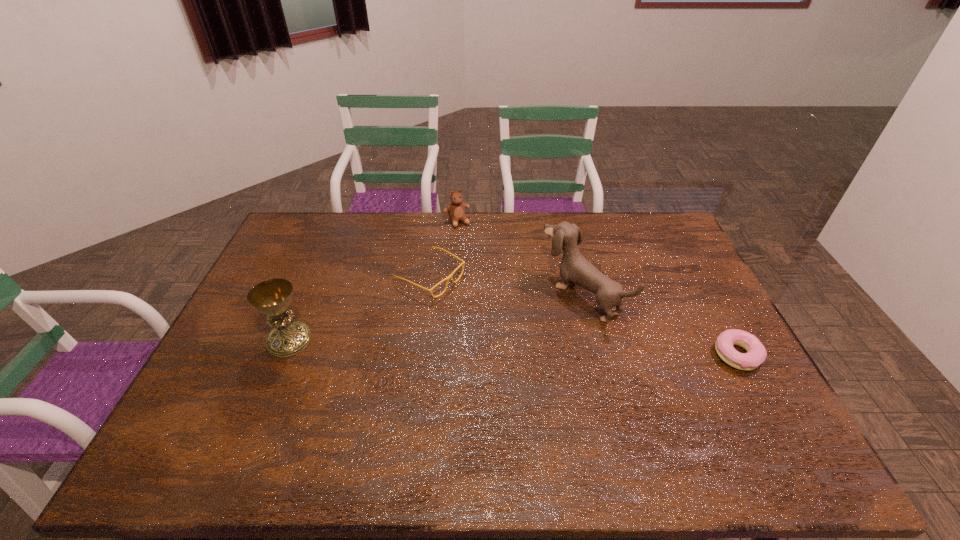
The height and width of the screenshot is (540, 960). What are the coordinates of `the leftmost object` in the screenshot? It's located at (272, 297).

Where is `doughnut`? This screenshot has width=960, height=540. doughnut is located at coordinates (756, 354).

At what (x,y) coordinates should I click in order to perform the action: click on spectacles. Please return your answer as a coordinate pair (x, y). This screenshot has width=960, height=540. Looking at the image, I should click on (463, 262).

The height and width of the screenshot is (540, 960). In order to click on puppy in this screenshot , I will do `click(574, 267)`.

Where is `the third shortest object`? the third shortest object is located at coordinates (456, 210).

At what (x,y) coordinates should I click in order to perform the action: click on teddy bear. Please return your answer as a coordinate pair (x, y). Looking at the image, I should click on (456, 210).

Identify the location of free point located 0.130m on the right of the chalice. (356, 340).

At what (x,y) coordinates should I click in order to perform the action: click on free space located on the back of the doughnut. Please return your answer as a coordinate pair (x, y). Looking at the image, I should click on (715, 315).

Identify the location of vacant position located in front of the lenses of the spectacles. (498, 314).

I want to click on vacant space located in front of the lenses of the spectacles, so click(493, 311).